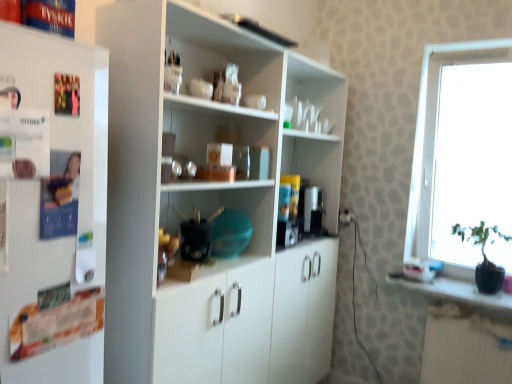
Question: Does transparent glass window at right have a smaller size compared to white matte cupboard at center?

Choices:
 (A) yes
 (B) no

Answer: (A)

Question: From the image's perspective, does transparent glass window at right appear lower than white matte cupboard at center?

Choices:
 (A) no
 (B) yes

Answer: (A)

Question: Is transparent glass window at right shorter than white matte cupboard at center?

Choices:
 (A) yes
 (B) no

Answer: (A)

Question: Is transparent glass window at right looking in the opposite direction of white matte cupboard at center?

Choices:
 (A) no
 (B) yes

Answer: (A)

Question: Is transparent glass window at right next to white matte cupboard at center?

Choices:
 (A) no
 (B) yes

Answer: (A)

Question: From a real-world perspective, is transparent glass window at right physically below white matte cupboard at center?

Choices:
 (A) no
 (B) yes

Answer: (A)

Question: From the image's perspective, is black glossy pot at right on white matte cupboard at center?

Choices:
 (A) no
 (B) yes

Answer: (A)

Question: Does black glossy pot at right have a smaller size compared to white matte cupboard at center?

Choices:
 (A) no
 (B) yes

Answer: (B)

Question: Is black glossy pot at right thinner than white matte cupboard at center?

Choices:
 (A) no
 (B) yes

Answer: (B)

Question: Is black glossy pot at right further to camera compared to white matte cupboard at center?

Choices:
 (A) no
 (B) yes

Answer: (B)

Question: Is black glossy pot at right oriented towards white matte cupboard at center?

Choices:
 (A) yes
 (B) no

Answer: (B)

Question: Can you confirm if black glossy pot at right is wider than white matte cupboard at center?

Choices:
 (A) no
 (B) yes

Answer: (A)

Question: From the image's perspective, does white matte cupboard at center appear lower than black glossy pot at right?

Choices:
 (A) yes
 (B) no

Answer: (B)